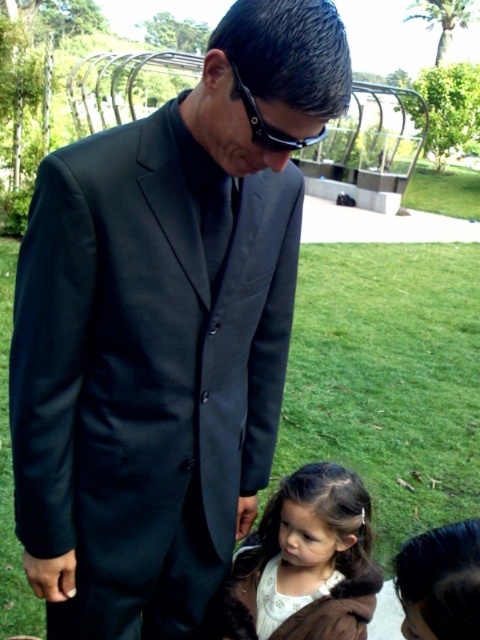
Can you confirm if white satin dress at lower center is shorter than black plastic goggles at center?

No, white satin dress at lower center is not shorter than black plastic goggles at center.

Does white satin dress at lower center have a greater height compared to black plastic goggles at center?

Yes.

Between point (249, 595) and point (275, 150), which one is positioned behind?

Positioned behind is point (249, 595).

The width and height of the screenshot is (480, 640). Find the location of `white satin dress at lower center`. white satin dress at lower center is located at coordinates (336, 611).

Does brown fur coat at lower right have a larger size compared to black plastic goggles at center?

Correct, brown fur coat at lower right is larger in size than black plastic goggles at center.

At what (x,y) coordinates should I click in order to perform the action: click on brown fur coat at lower right. Please return your answer as a coordinate pair (x, y). Image resolution: width=480 pixels, height=640 pixels. Looking at the image, I should click on (441, 582).

Which is in front, point (450, 570) or point (250, 122)?

Point (450, 570) is in front.

Find the location of a particular element. The image size is (480, 640). brown fur coat at lower right is located at coordinates (441, 582).

Image resolution: width=480 pixels, height=640 pixels. What do you see at coordinates (164, 332) in the screenshot?
I see `matte black suit at center` at bounding box center [164, 332].

Which is below, matte black suit at center or white fur coat at lower center?

Positioned lower is white fur coat at lower center.

Locate an element on the screen. The image size is (480, 640). matte black suit at center is located at coordinates (164, 332).